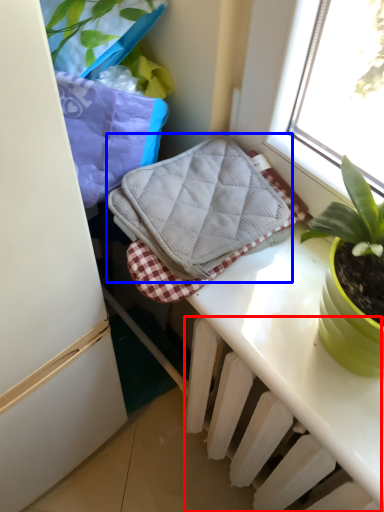
Question: Which object is closer to the camera taking this photo, radiator (highlighted by a red box) or bath towel (highlighted by a blue box)?

Choices:
 (A) radiator
 (B) bath towel

Answer: (A)